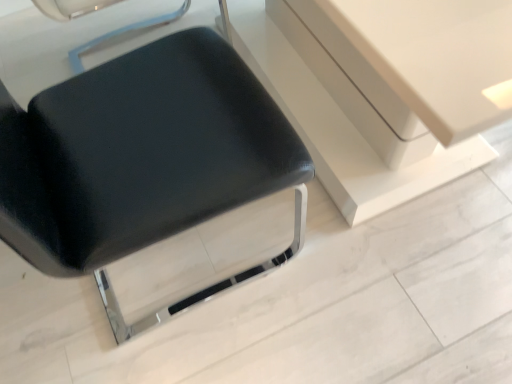
Describe the element at coordinates (339, 126) in the screenshot. I see `matte black vanity at center` at that location.

Identify the location of matte black vanity at center. (339, 126).

Find the location of a particular element. This screenshot has width=512, height=384. black leather chair at center is located at coordinates (147, 168).

Describe the element at coordinates (147, 168) in the screenshot. I see `black leather chair at center` at that location.

What are the coordinates of `matte black vanity at center` in the screenshot? It's located at (339, 126).

Is black leather chair at center to the left of matte black vanity at center from the viewer's perspective?

Correct, you'll find black leather chair at center to the left of matte black vanity at center.

Does black leather chair at center lie in front of matte black vanity at center?

Yes, black leather chair at center is in front of matte black vanity at center.

Is point (55, 197) closer to viewer compared to point (244, 13)?

Yes, point (55, 197) is closer to viewer.

From the image's perspective, which object appears higher, black leather chair at center or matte black vanity at center?

From the image's view, matte black vanity at center is above.

From a real-world perspective, which object stands above the other?

black leather chair at center is physically above.

Is black leather chair at center thinner than matte black vanity at center?

Indeed, black leather chair at center has a lesser width compared to matte black vanity at center.

In the scene shown: Is black leather chair at center taller or shorter than matte black vanity at center?

black leather chair at center is taller than matte black vanity at center.

Based on their sizes in the image, would you say black leather chair at center is bigger or smaller than matte black vanity at center?

Clearly, black leather chair at center is smaller in size than matte black vanity at center.

Is black leather chair at center positioned beyond the bounds of matte black vanity at center?

Yes, black leather chair at center is outside of matte black vanity at center.

Is black leather chair at center far from matte black vanity at center?

They are positioned close to each other.

Is black leather chair at center looking in the opposite direction of matte black vanity at center?

black leather chair at center does not have its back to matte black vanity at center.

Locate an element on the screen. chair in front of the matte black vanity at center is located at coordinates (147, 168).

Which is more to the right, matte black vanity at center or black leather chair at center?

From the viewer's perspective, matte black vanity at center appears more on the right side.

Is matte black vanity at center in front of or behind black leather chair at center in the image?

Visually, matte black vanity at center is located behind black leather chair at center.

Is point (263, 18) positioned behind point (128, 15)?

No.

From the image's perspective, is matte black vanity at center above or below black leather chair at center?

matte black vanity at center is above black leather chair at center.

From a real-world perspective, between matte black vanity at center and black leather chair at center, who is vertically higher?

black leather chair at center.

Is matte black vanity at center wider or thinner than black leather chair at center?

In the image, matte black vanity at center appears to be wider than black leather chair at center.

Does matte black vanity at center have a greater height compared to black leather chair at center?

No.

Can you confirm if matte black vanity at center is bigger than black leather chair at center?

Indeed, matte black vanity at center has a larger size compared to black leather chair at center.

Is matte black vanity at center spatially inside black leather chair at center, or outside of it?

The correct answer is: outside.

Is matte black vanity at center far away from black leather chair at center?

matte black vanity at center is near black leather chair at center, not far away.

Is matte black vanity at center oriented away from black leather chair at center?

Yes.

What's the angular difference between matte black vanity at center and black leather chair at center's facing directions?

matte black vanity at center and black leather chair at center are facing 2.78 degrees away from each other.

At what (x,y) coordinates should I click in order to perform the action: click on vanity to the right of black leather chair at center. Please return your answer as a coordinate pair (x, y). Looking at the image, I should click on (339, 126).

Where is `chair located in front of the matte black vanity at center`? This screenshot has height=384, width=512. chair located in front of the matte black vanity at center is located at coordinates (147, 168).

Image resolution: width=512 pixels, height=384 pixels. In order to click on chair on the left of matte black vanity at center in this screenshot , I will do `click(147, 168)`.